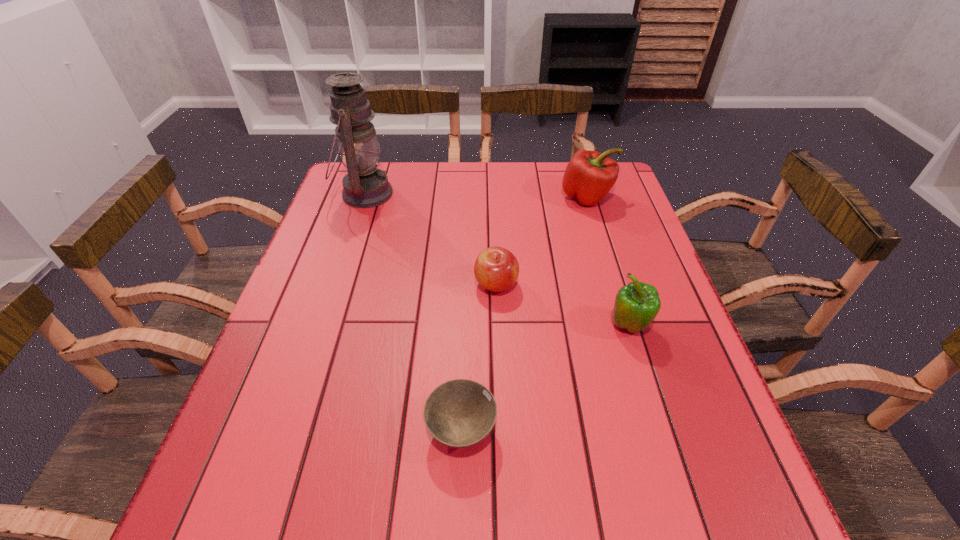
Find the location of `the tallest object`. the tallest object is located at coordinates (365, 186).

The height and width of the screenshot is (540, 960). I want to click on oil lamp, so click(x=365, y=186).

At what (x,y) coordinates should I click in order to perform the action: click on the farther bell pepper. Please return your answer as a coordinate pair (x, y). Looking at the image, I should click on click(x=589, y=176).

Locate an element on the screen. The width and height of the screenshot is (960, 540). the fourth farthest object is located at coordinates (636, 305).

I want to click on apple, so click(496, 269).

At what (x,y) coordinates should I click in order to perform the action: click on the second shortest object. Please return your answer as a coordinate pair (x, y). The image size is (960, 540). Looking at the image, I should click on [496, 269].

Where is `the shortest object`? Image resolution: width=960 pixels, height=540 pixels. the shortest object is located at coordinates (460, 413).

Find the location of `the nearest object`. the nearest object is located at coordinates (460, 413).

Where is `free spot located on the front of the leftmost object`? Image resolution: width=960 pixels, height=540 pixels. free spot located on the front of the leftmost object is located at coordinates (332, 292).

Identify the location of free space located on the front of the farther bell pepper. (608, 261).